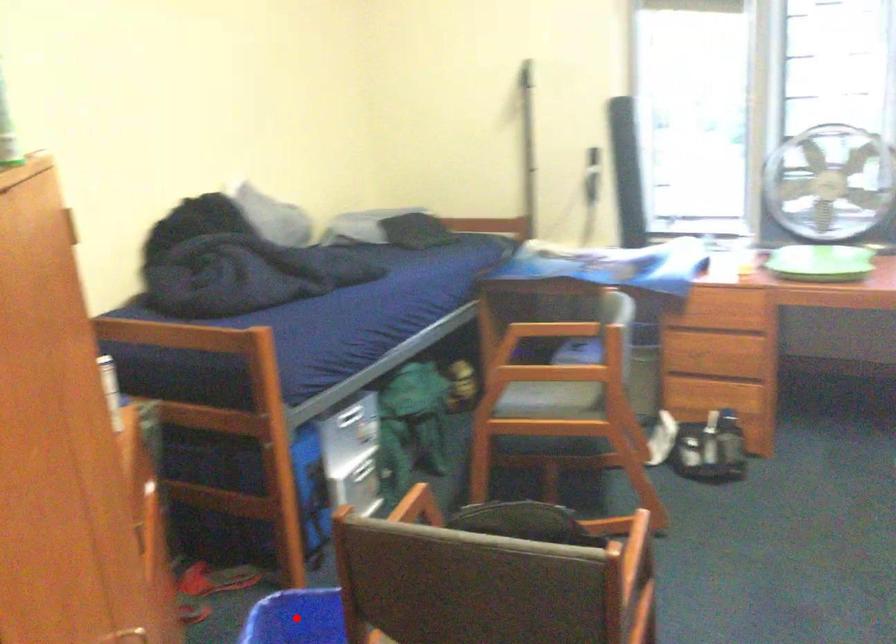
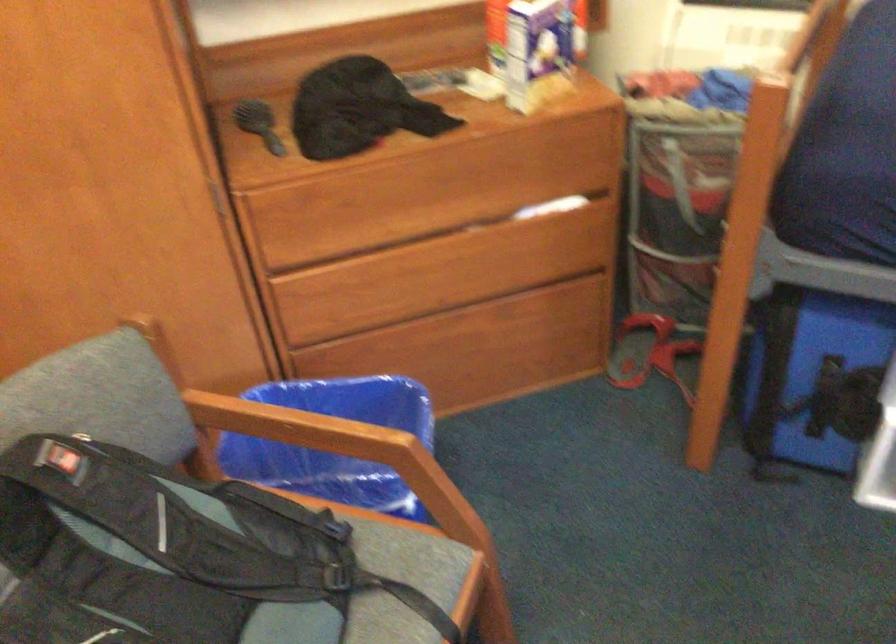
Question: I am providing you with two images of the same scene from different viewpoints. A red point is marked on the first image. Can you still see the location of the red point in image 2?

Choices:
 (A) Yes
 (B) No

Answer: (B)